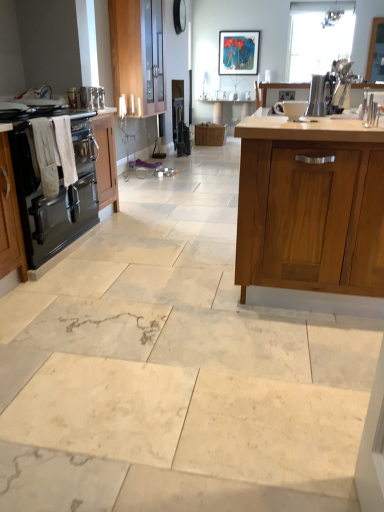
Question: Considering the relative sizes of satin silver toaster at center, the 4th appliance positioned from the front, and white glossy bowl at upper center, the second appliance viewed from the left, in the image provided, is satin silver toaster at center, the 4th appliance positioned from the front, thinner than white glossy bowl at upper center, the second appliance viewed from the left,?

Choices:
 (A) yes
 (B) no

Answer: (A)

Question: Does satin silver toaster at center, which appears as the 1th appliance when viewed from the right, appear on the right side of white glossy bowl at upper center, placed as the 4th appliance when sorted from top to bottom?

Choices:
 (A) yes
 (B) no

Answer: (A)

Question: Is satin silver toaster at center, marked as the 4th appliance in a left-to-right arrangement, next to white glossy bowl at upper center, arranged as the fourth appliance when viewed from the back?

Choices:
 (A) no
 (B) yes

Answer: (A)

Question: From the image's perspective, does satin silver toaster at center, marked as the 4th appliance in a left-to-right arrangement, appear lower than white glossy bowl at upper center, arranged as the fourth appliance when viewed from the back?

Choices:
 (A) no
 (B) yes

Answer: (A)

Question: Is satin silver toaster at center, arranged as the 4th appliance when ordered from the bottom, far from white glossy bowl at upper center, arranged as the fourth appliance when viewed from the back?

Choices:
 (A) yes
 (B) no

Answer: (B)

Question: In the image, is wooden cabinet at upper left, the second cabinetry when ordered from right to left, on the left side or the right side of white cotton towel at left?

Choices:
 (A) right
 (B) left

Answer: (A)

Question: Considering the positions of wooden cabinet at upper left, which is counted as the 2th cabinetry, starting from the left, and white cotton towel at left in the image, is wooden cabinet at upper left, which is counted as the 2th cabinetry, starting from the left, bigger or smaller than white cotton towel at left?

Choices:
 (A) small
 (B) big

Answer: (B)

Question: Is point (112, 26) closer or farther from the camera than point (48, 123)?

Choices:
 (A) closer
 (B) farther

Answer: (B)

Question: From a real-world perspective, relative to white cotton towel at left, is wooden cabinet at upper left, which is counted as the 2th cabinetry, starting from the left, vertically above or below?

Choices:
 (A) above
 (B) below

Answer: (A)

Question: Is white cotton towel at left wider or thinner than wooden table at center?

Choices:
 (A) wide
 (B) thin

Answer: (B)

Question: From a real-world perspective, is white cotton towel at left positioned above or below wooden table at center?

Choices:
 (A) below
 (B) above

Answer: (B)

Question: Is white cotton towel at left situated inside wooden table at center or outside?

Choices:
 (A) outside
 (B) inside

Answer: (A)

Question: Does point (56, 182) appear closer or farther from the camera than point (221, 106)?

Choices:
 (A) farther
 (B) closer

Answer: (B)

Question: In the image, is white cotton towel at left positioned in front of or behind metallic silver kettle at upper left, the 3th appliance viewed from the front?

Choices:
 (A) behind
 (B) front

Answer: (B)

Question: Is white cotton towel at left bigger or smaller than metallic silver kettle at upper left, the first appliance positioned from the left?

Choices:
 (A) small
 (B) big

Answer: (B)